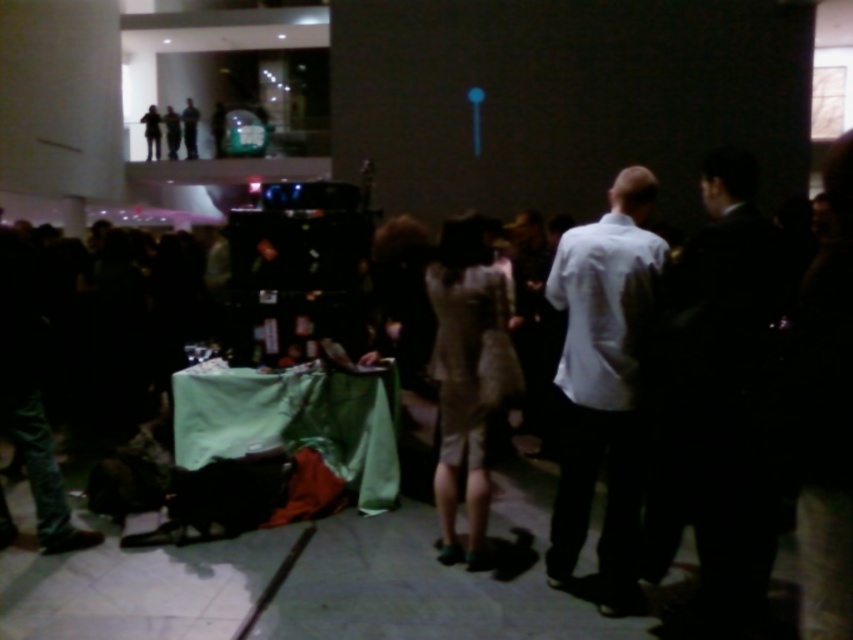
Who is more forward, (682, 426) or (608, 250)?

Point (682, 426) is more forward.

Describe the element at coordinates (717, 404) in the screenshot. This screenshot has width=853, height=640. I see `dark suit at right` at that location.

At what (x,y) coordinates should I click in order to perform the action: click on dark suit at right. Please return your answer as a coordinate pair (x, y). Looking at the image, I should click on (717, 404).